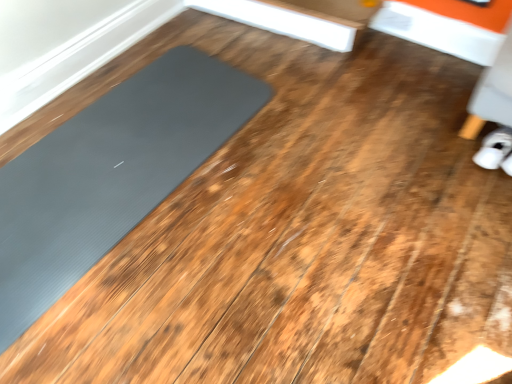
Where is `vacant space in front of white fabric shoe at lower right`? vacant space in front of white fabric shoe at lower right is located at coordinates (488, 190).